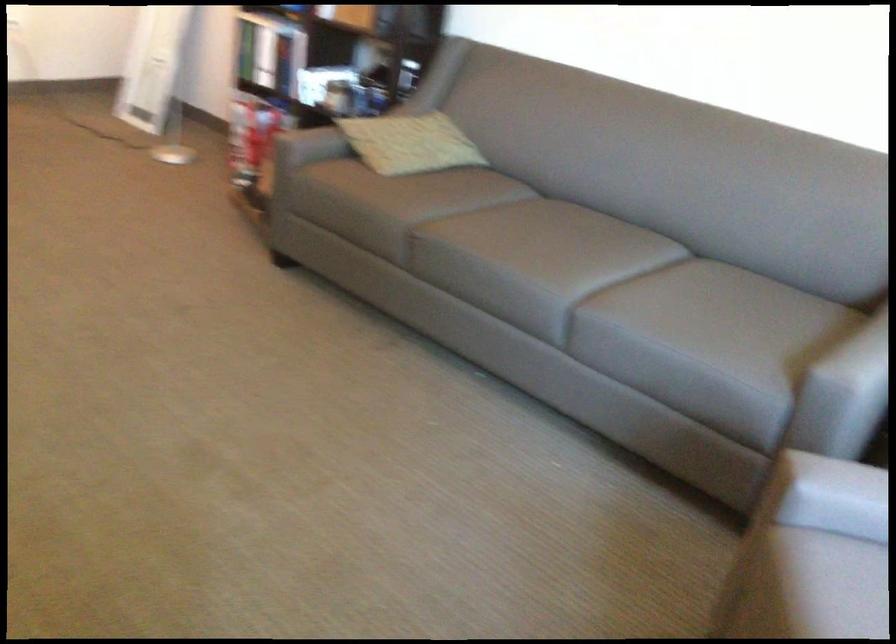
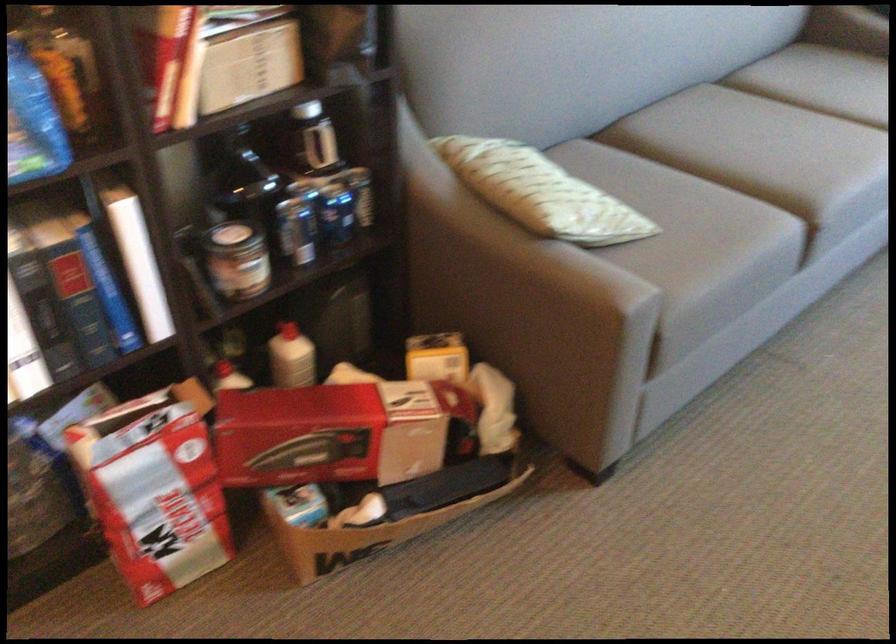
Locate, in the second image, the point that corresponds to (x=291, y=73) in the first image.

(237, 260)